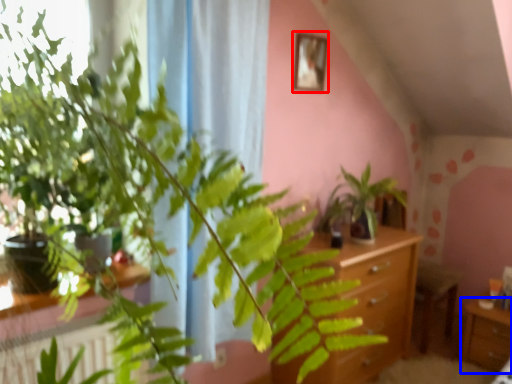
Question: Which point is further to the camera, picture frame (highlighted by a red box) or table (highlighted by a blue box)?

Choices:
 (A) picture frame
 (B) table

Answer: (B)